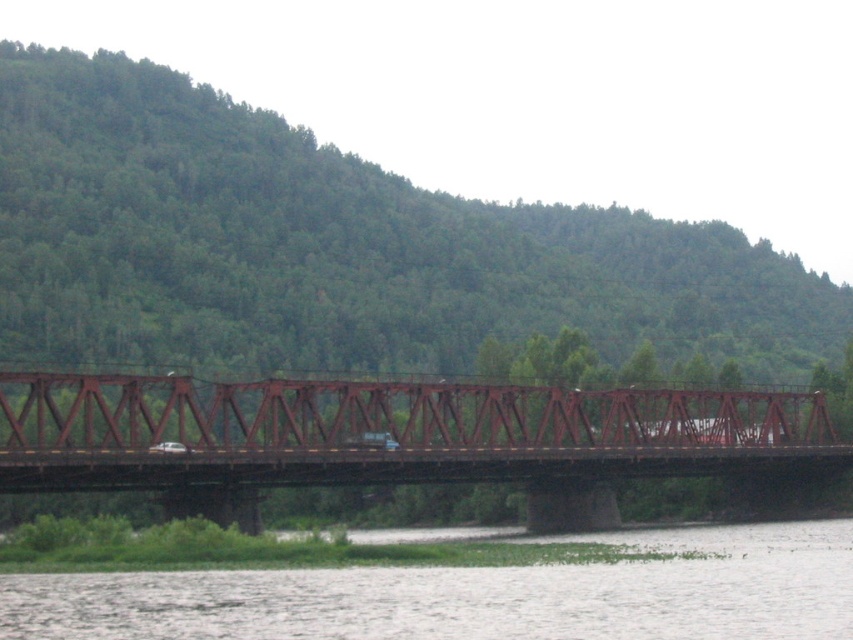
Question: Is rusty metal bridge at center closer to camera compared to white water at lower center?

Choices:
 (A) no
 (B) yes

Answer: (A)

Question: Among these objects, which one is farthest from the camera?

Choices:
 (A) rusty metal bridge at center
 (B) white water at lower center

Answer: (A)

Question: Is rusty metal bridge at center wider than white water at lower center?

Choices:
 (A) no
 (B) yes

Answer: (B)

Question: Where is rusty metal bridge at center located in relation to white water at lower center in the image?

Choices:
 (A) right
 (B) left

Answer: (B)